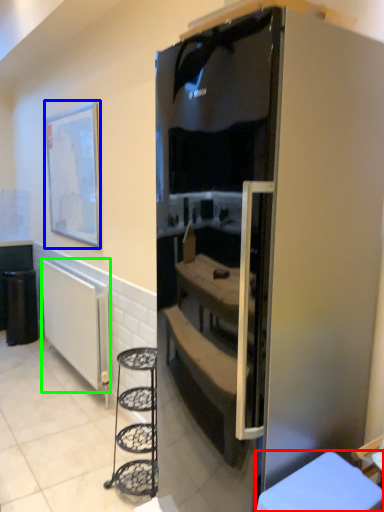
Question: Which object is positioned closest to furniture (highlighted by a red box)? Select from picture frame (highlighted by a blue box) and radiator (highlighted by a green box).

Choices:
 (A) picture frame
 (B) radiator

Answer: (B)